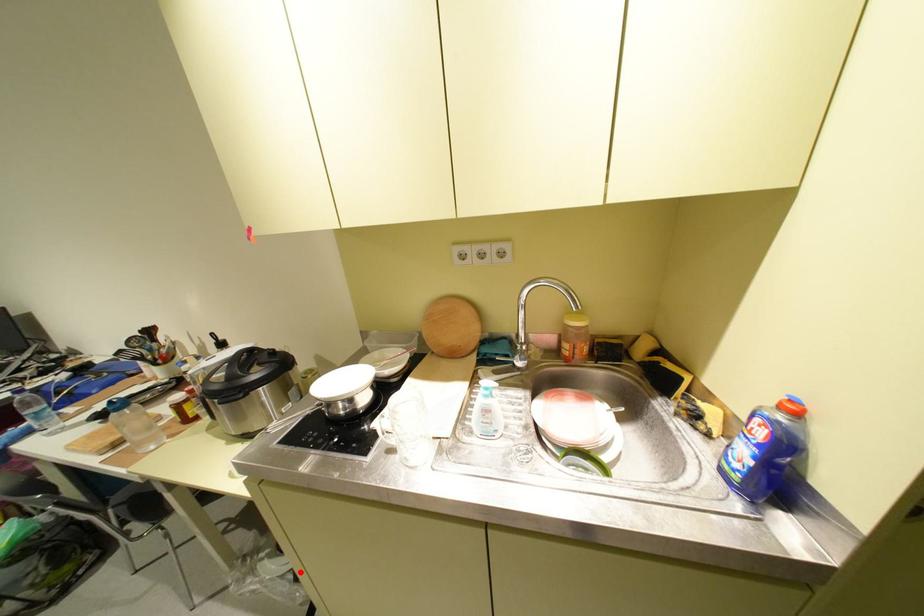
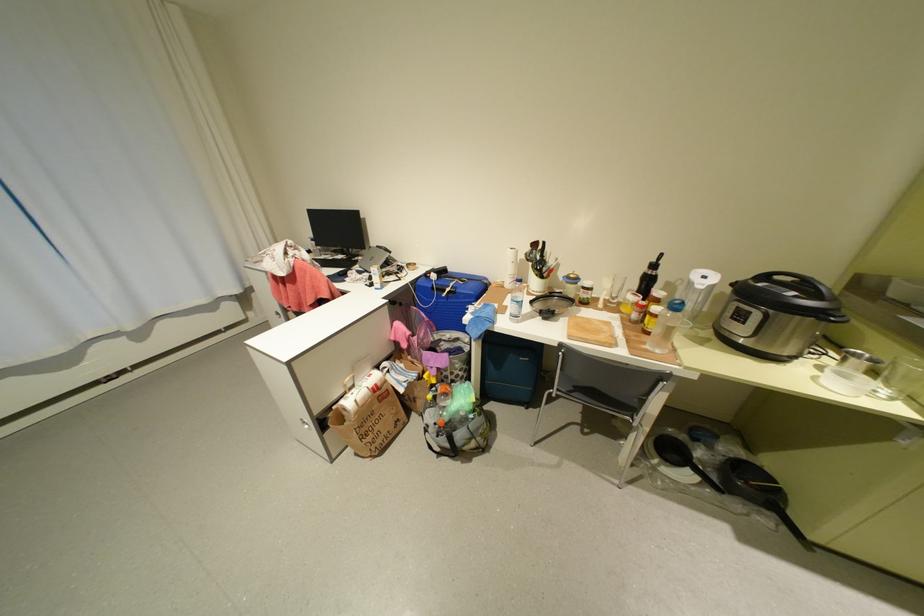
Find the pixel in the second image that matches the highlighted location in the first image.

(711, 484)